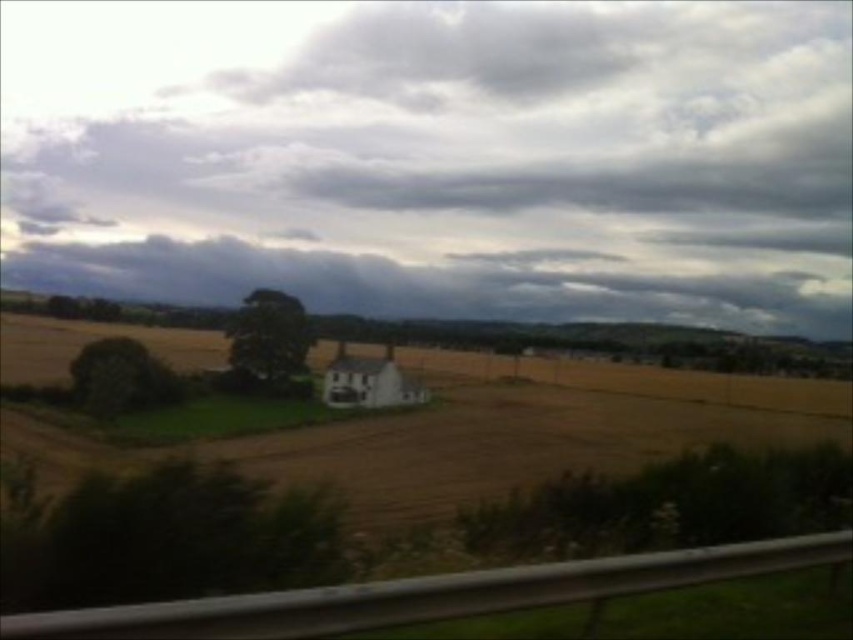
Identify the location of cloudy sky at upper center. 436,156.

Is point (463, 253) closer to viewer compared to point (245, 339)?

No.

The width and height of the screenshot is (853, 640). I want to click on cloudy sky at upper center, so click(x=436, y=156).

Between point (340, 518) and point (158, 374), which one is positioned in front?

Point (340, 518) is more forward.

Who is taller, green leafy tree at lower left or green leafy tree at left?

With more height is green leafy tree at left.

Is point (80, 524) positioned after point (91, 364)?

No.

Where is `green leafy tree at lower left`? This screenshot has height=640, width=853. green leafy tree at lower left is located at coordinates (171, 538).

Who is taller, cloudy sky at upper center or golden matte wheat field at center?

cloudy sky at upper center is taller.

Is cloudy sky at upper center to the right of golden matte wheat field at center from the viewer's perspective?

No, cloudy sky at upper center is not to the right of golden matte wheat field at center.

Locate an element on the screen. The image size is (853, 640). cloudy sky at upper center is located at coordinates (436, 156).

Image resolution: width=853 pixels, height=640 pixels. Identify the location of cloudy sky at upper center. (436, 156).